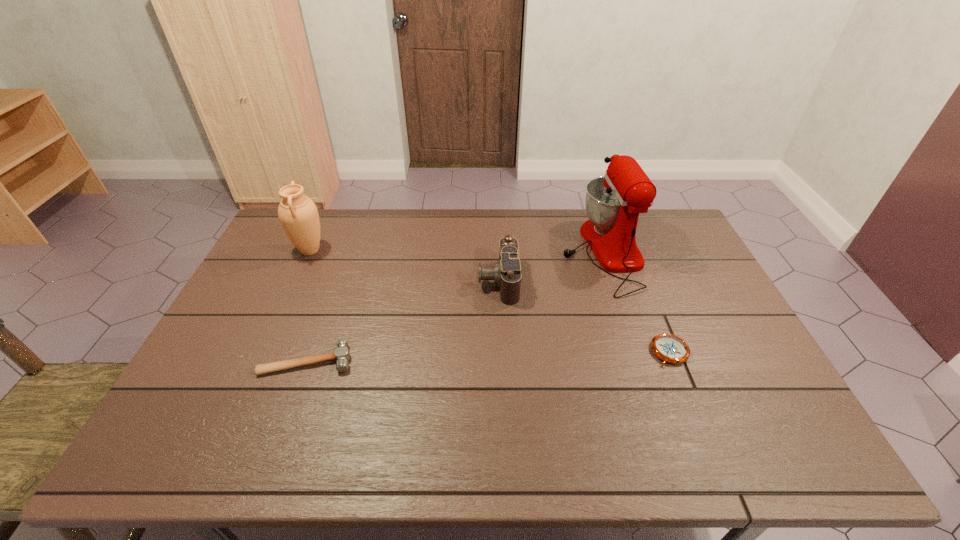
You are a GUI agent. You are given a task and a screenshot of the screen. Output one action in this format:
    pyautogui.click(x=<x>, y=<y>)
    Task: Click on the free space between the tallest object and the second tallest object
    
    Given the screenshot: What is the action you would take?
    pyautogui.click(x=456, y=252)

Locate an element on the screen. This screenshot has height=540, width=960. free space that is in between the compass and the mixer is located at coordinates (636, 302).

This screenshot has height=540, width=960. In order to click on vacant space that is in between the compass and the second shortest object in this screenshot , I will do `click(489, 356)`.

Identify the location of free space that is in between the second shortest object and the compass. (489, 356).

At what (x,y) coordinates should I click in order to perform the action: click on free space between the mixer and the hammer. Please return your answer as a coordinate pair (x, y). The image size is (960, 540). Looking at the image, I should click on (455, 306).

The height and width of the screenshot is (540, 960). In order to click on empty space that is in between the tallest object and the third shortest object in this screenshot , I will do `click(550, 267)`.

In order to click on object that ranks as the second closest to the shortest object in this screenshot , I will do `click(506, 272)`.

Locate which object is the second closest to the urn. Please provide its 2D coordinates. Your answer should be formatted as a tuple, i.e. [(x, y)], where the tuple contains the x and y coordinates of a point satisfying the conditions above.

[(506, 272)]

Where is `vacant position in the image that satisfies the following two spatial constraints: 1. on the front-facing side of the shortest object; 2. on the right side of the third object from left to right`? The width and height of the screenshot is (960, 540). vacant position in the image that satisfies the following two spatial constraints: 1. on the front-facing side of the shortest object; 2. on the right side of the third object from left to right is located at coordinates (501, 352).

Locate an element on the screen. This screenshot has width=960, height=540. vacant region that satisfies the following two spatial constraints: 1. on the front-facing side of the compass; 2. on the right side of the third shortest object is located at coordinates coord(501,352).